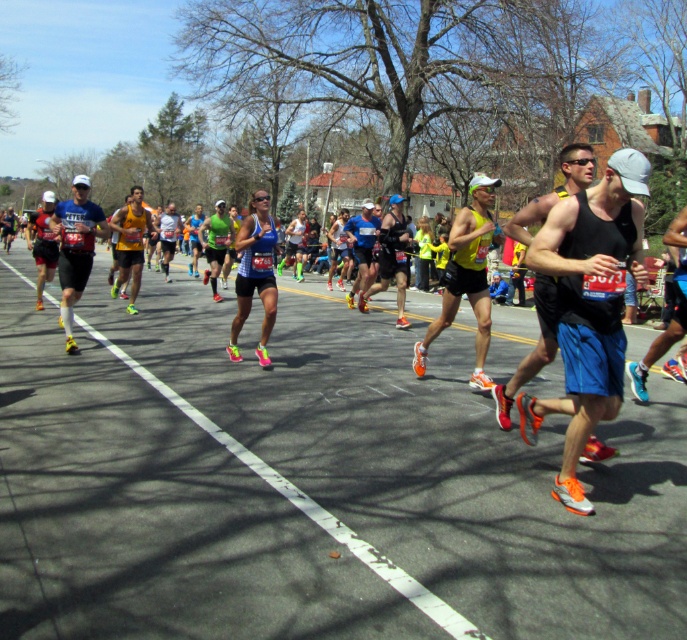
Based on the photo, you are a photographer positioned at the starting line of the marathon. You want to capture a photo of the matte black tank top at center. Based on its coordinates, would you need to pan your camera to the left or right to frame it properly?

The matte black tank top at center is located at coordinates point (587, 307). Since the x coordinate is 0.481, which is slightly to the left of the center point 0.5, you should pan your camera slightly to the left to frame it properly.

You are a photographer positioned at the starting line of the marathon. You want to capture a photo of the matte black tank top at center and the matte black shorts at left. Which piece of clothing will appear larger in your photo?

The matte black tank top at center appears larger in the photo because it is closer to the viewer than the matte black shorts at left.